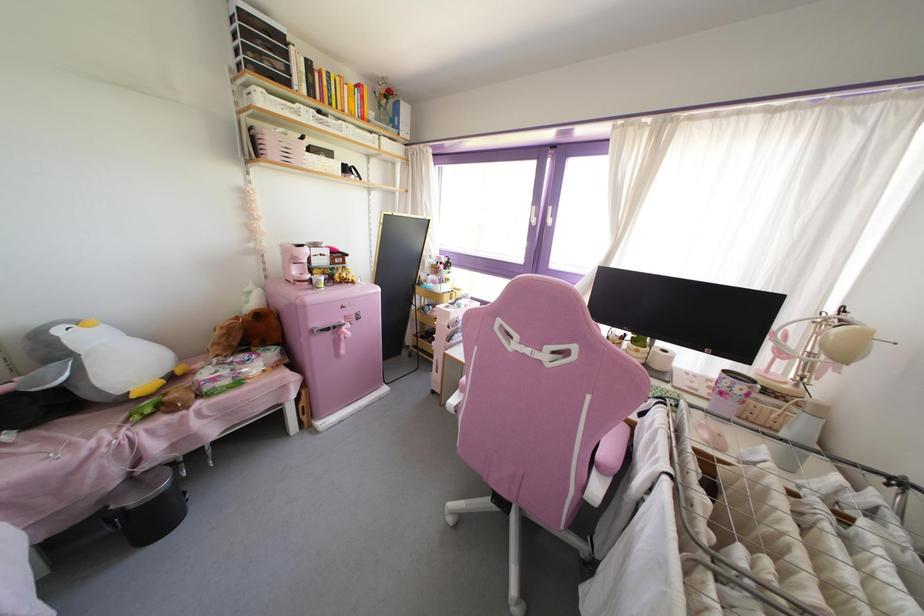
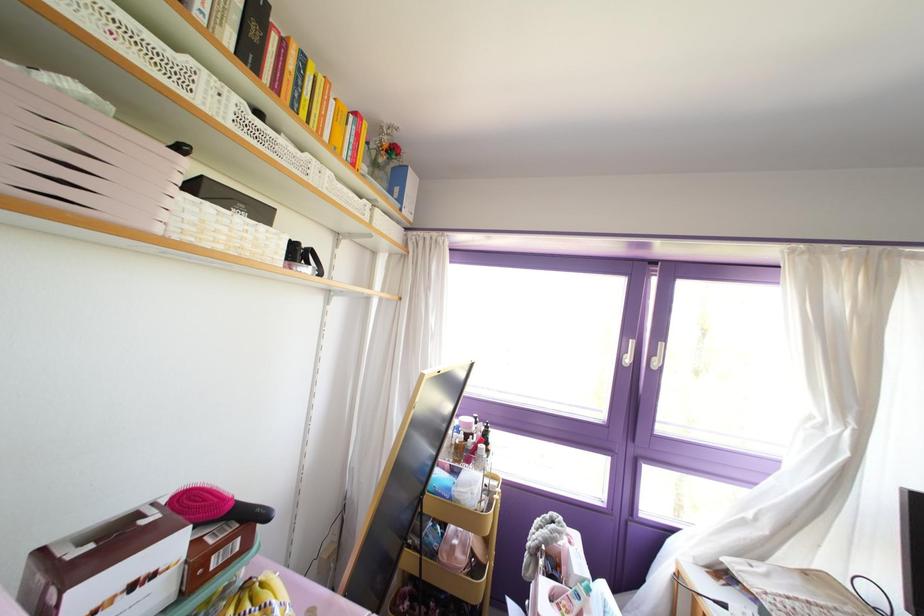
In the second image, find the point that corresponds to point (532, 220) in the first image.

(626, 360)